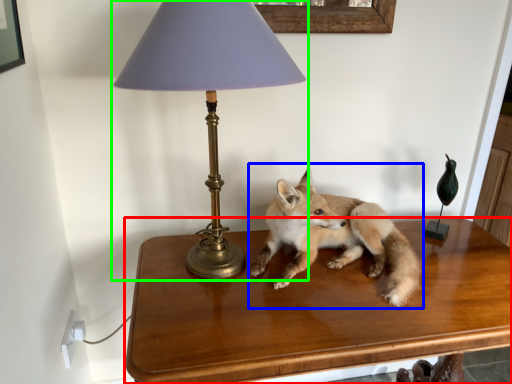
Question: Which object is positioned closest to table (highlighted by a red box)? Select from fox (highlighted by a blue box) and lamp (highlighted by a green box).

Choices:
 (A) fox
 (B) lamp

Answer: (A)